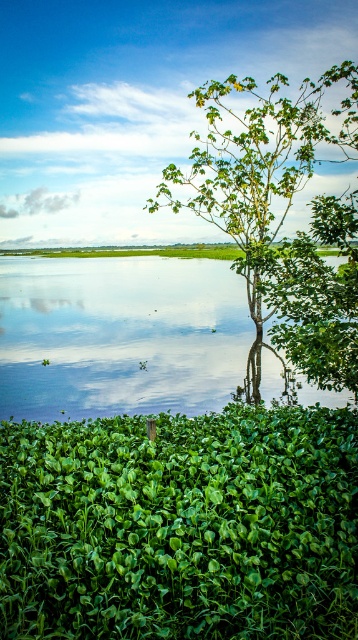
Question: Can you confirm if green leafy plant at lower center is positioned above transparent water at center?

Choices:
 (A) yes
 (B) no

Answer: (B)

Question: Among these points, which one is farthest from the camera?

Choices:
 (A) (239, 205)
 (B) (184, 349)

Answer: (B)

Question: Is transparent water at center above green leafy tree at center?

Choices:
 (A) yes
 (B) no

Answer: (B)

Question: Can you confirm if green leafy plant at lower center is wider than green leafy tree at center?

Choices:
 (A) no
 (B) yes

Answer: (A)

Question: Which object appears closest to the camera in this image?

Choices:
 (A) transparent water at center
 (B) green leafy plant at lower center

Answer: (B)

Question: Which point appears closest to the camera in this image?

Choices:
 (A) (323, 420)
 (B) (308, 140)

Answer: (A)